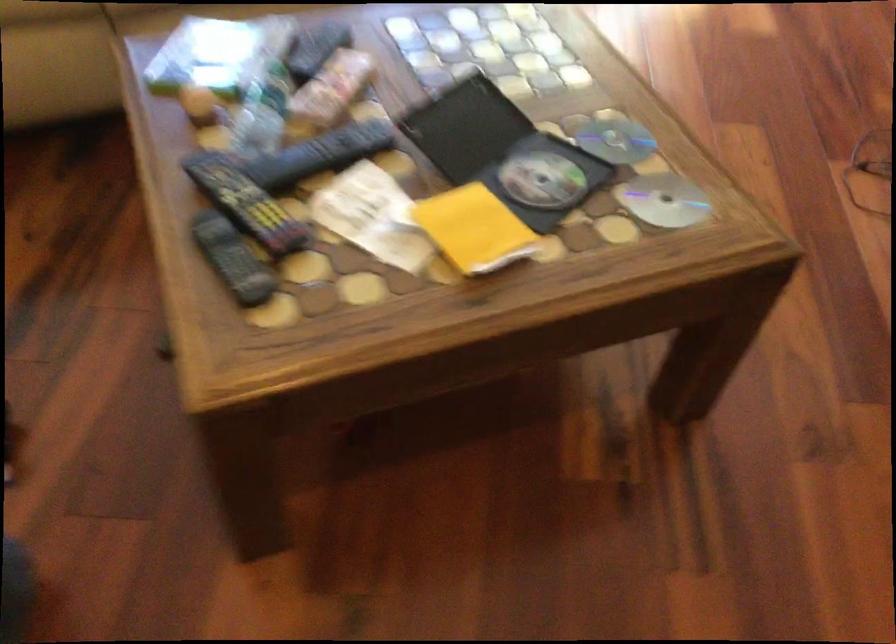
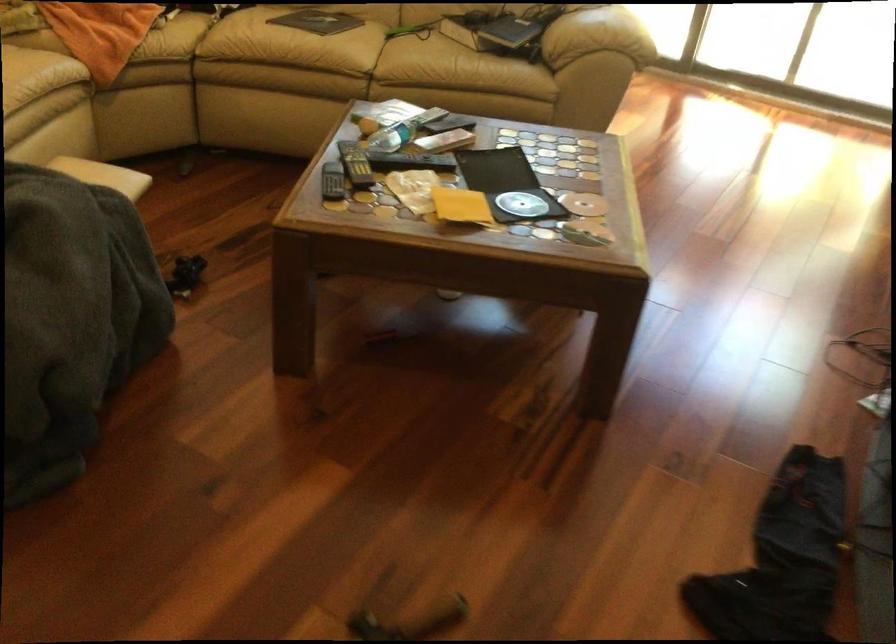
Find the pixel in the second image that matches the point at 246,263 in the first image.

(332, 182)